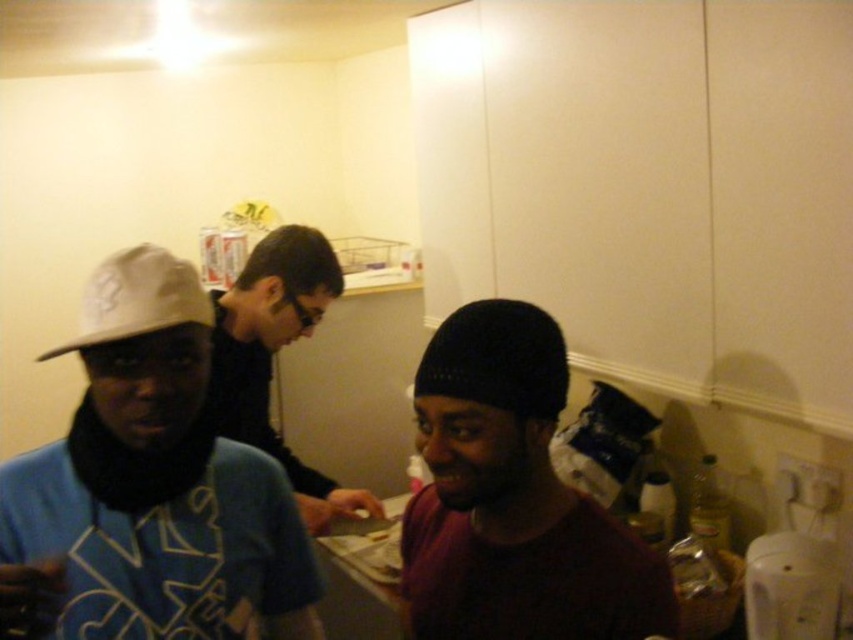
You are standing in the kitchen and see the black matte shirt at center and the white matte baseball cap at upper left. Which object is positioned lower in the image?

The black matte shirt at center is located below the white matte baseball cap at upper left, so it is positioned lower in the image.

In the image, there is a white matte cap at upper left. Where exactly is it located in terms of coordinates?

The white matte cap at upper left is located at coordinates point (x=164, y=548).